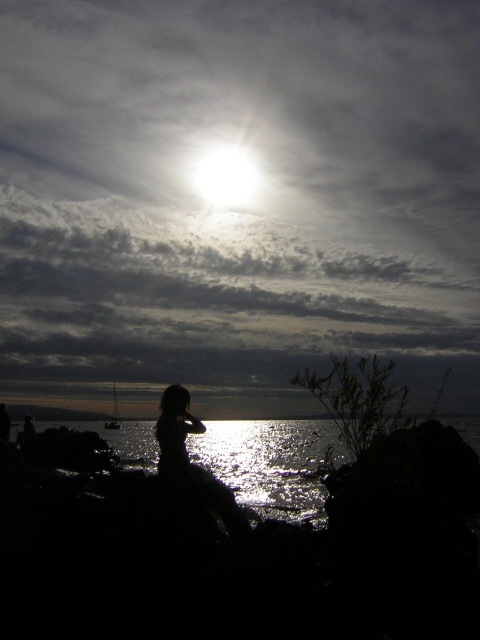
Where is `glistening reflective water at lower center`? This screenshot has height=640, width=480. glistening reflective water at lower center is located at coordinates (269, 461).

Does glistening reflective water at lower center have a lesser width compared to silhouette dress at center?

No, glistening reflective water at lower center is not thinner than silhouette dress at center.

The image size is (480, 640). What do you see at coordinates (269, 461) in the screenshot? I see `glistening reflective water at lower center` at bounding box center [269, 461].

Find the location of a particular element. glistening reflective water at lower center is located at coordinates (269, 461).

Is glistening reflective water at lower center closer to the viewer compared to bright white light at upper center?

That is True.

Looking at this image, is glistening reflective water at lower center above bright white light at upper center?

No, glistening reflective water at lower center is not above bright white light at upper center.

Is point (212, 467) in front of point (248, 198)?

Yes, point (212, 467) is in front of point (248, 198).

The width and height of the screenshot is (480, 640). Find the location of `glistening reflective water at lower center`. glistening reflective water at lower center is located at coordinates (269, 461).

Describe the element at coordinates (192, 464) in the screenshot. This screenshot has height=640, width=480. I see `silhouette dress at center` at that location.

Is point (189, 396) in front of point (245, 186)?

Yes.

The height and width of the screenshot is (640, 480). What do you see at coordinates (192, 464) in the screenshot?
I see `silhouette dress at center` at bounding box center [192, 464].

The image size is (480, 640). Identify the location of silhouette dress at center. (192, 464).